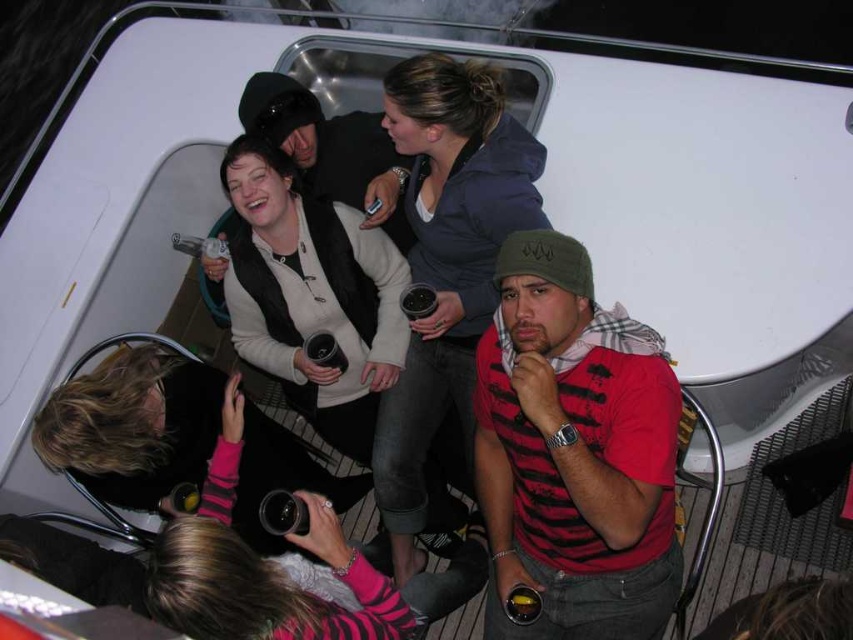
You are a photographer trying to capture a candid shot of the white matte sweater at center without including the red striped shirt at center in the frame. Is this possible given their positions?

The red striped shirt at center is in front of the white matte sweater at center, so it would block the view. Therefore, you cannot capture the white matte sweater at center without including the red striped shirt at center in the frame.

Based on the photo, you are a photographer trying to capture a clear shot of the dark gray hoodie at upper center and the white matte sweater at center. Since the cabin is dimly lit, you need to adjust your camera settings. However, you notice that one of the subjects is partially blocking the other. Which clothing item is closer to the camera, making it easier to focus on?

The dark gray hoodie at upper center is in front of the white matte sweater at center, so it is closer to the camera and easier to focus on.